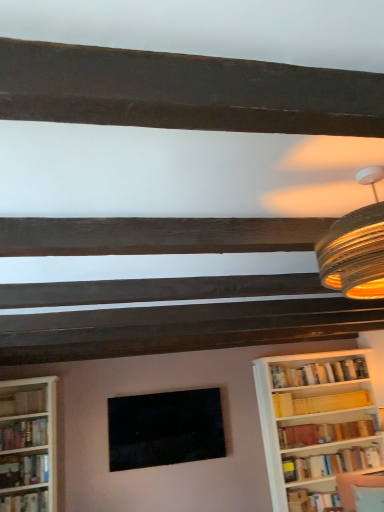
Question: Can you confirm if hardcover book at lower right, which appears as the third book when viewed from the right, is bigger than hardcover book at left, which ranks as the 3th book in left-to-right order?

Choices:
 (A) yes
 (B) no

Answer: (B)

Question: Is hardcover book at lower right, which appears as the third book when viewed from the right, turned away from hardcover book at left, positioned as the fifth book in right-to-left order?

Choices:
 (A) no
 (B) yes

Answer: (A)

Question: Does hardcover book at lower right, the 5th book from the left, lie in front of hardcover book at left, which ranks as the 3th book in left-to-right order?

Choices:
 (A) yes
 (B) no

Answer: (B)

Question: Would you say hardcover book at lower right, which appears as the third book when viewed from the right, is outside hardcover book at left, which ranks as the 3th book in left-to-right order?

Choices:
 (A) no
 (B) yes

Answer: (B)

Question: From the image's perspective, does hardcover book at lower right, the 5th book from the left, appear lower than hardcover book at left, positioned as the fifth book in right-to-left order?

Choices:
 (A) no
 (B) yes

Answer: (B)

Question: Considering the relative positions of hardcover book at lower right, the 5th book from the left, and hardcover book at left, which ranks as the 3th book in left-to-right order, in the image provided, is hardcover book at lower right, the 5th book from the left, to the left of hardcover book at left, which ranks as the 3th book in left-to-right order, from the viewer's perspective?

Choices:
 (A) yes
 (B) no

Answer: (B)

Question: Does hardcover book at lower right, which appears as the third book when viewed from the right, have a smaller size compared to matte yellow bookshelf at right, marked as the 2th book in a right-to-left arrangement?

Choices:
 (A) yes
 (B) no

Answer: (A)

Question: From the image's perspective, does hardcover book at lower right, the 5th book from the left, appear lower than matte yellow bookshelf at right, marked as the 2th book in a right-to-left arrangement?

Choices:
 (A) no
 (B) yes

Answer: (B)

Question: From a real-world perspective, is hardcover book at lower right, which appears as the third book when viewed from the right, positioned under matte yellow bookshelf at right, which is the 6th book from left to right, based on gravity?

Choices:
 (A) no
 (B) yes

Answer: (B)

Question: From the image's perspective, does hardcover book at lower right, the 5th book from the left, appear higher than matte yellow bookshelf at right, marked as the 2th book in a right-to-left arrangement?

Choices:
 (A) yes
 (B) no

Answer: (B)

Question: Is hardcover book at lower right, the 5th book from the left, at the right side of matte yellow bookshelf at right, marked as the 2th book in a right-to-left arrangement?

Choices:
 (A) no
 (B) yes

Answer: (A)

Question: Is matte yellow bookshelf at right, marked as the 2th book in a right-to-left arrangement, located within hardcover book at lower right, which appears as the third book when viewed from the right?

Choices:
 (A) no
 (B) yes

Answer: (A)

Question: Is hardcover book at left, which ranks as the second book in left-to-right order, at the back of hardcover book at lower right, the 5th book from the left?

Choices:
 (A) no
 (B) yes

Answer: (A)